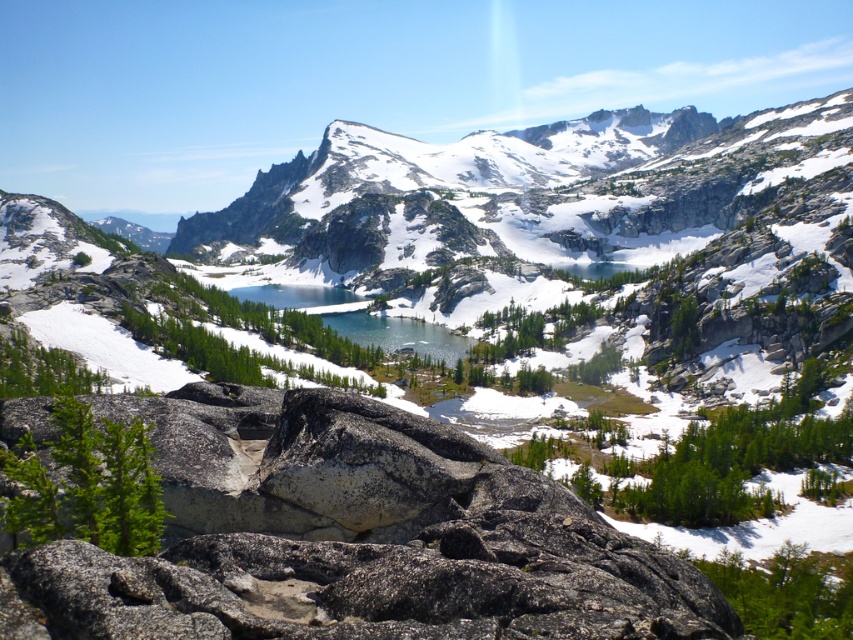
Question: Considering the relative positions of granite rock at center and clear blue water at center in the image provided, where is granite rock at center located with respect to clear blue water at center?

Choices:
 (A) above
 (B) below

Answer: (B)

Question: Which of the following is the closest to the observer?

Choices:
 (A) granite rock at center
 (B) clear blue water at center

Answer: (A)

Question: Does granite rock at center appear on the right side of clear blue water at center?

Choices:
 (A) no
 (B) yes

Answer: (B)

Question: Among these points, which one is nearest to the camera?

Choices:
 (A) (434, 333)
 (B) (637, 636)

Answer: (B)

Question: Does granite rock at center have a larger size compared to clear blue water at center?

Choices:
 (A) no
 (B) yes

Answer: (A)